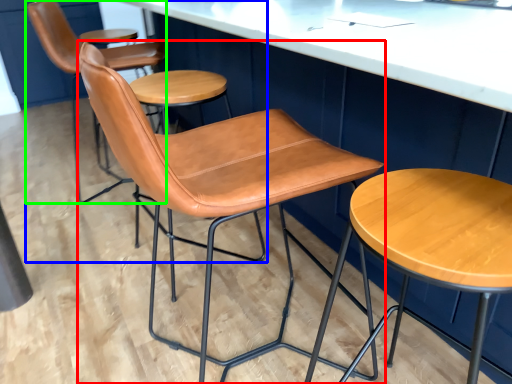
Question: Considering the real-world distances, which object is closest to chair (highlighted by a red box)? chair (highlighted by a blue box) or chair (highlighted by a green box).

Choices:
 (A) chair
 (B) chair

Answer: (A)